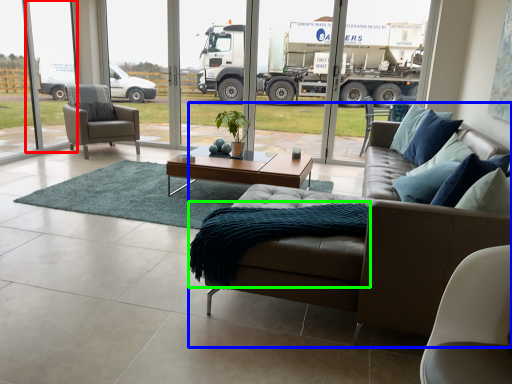
Question: Based on their relative distances, which object is nearer to window screen (highlighted by a red box)? Choose from studio couch (highlighted by a blue box) and blanket (highlighted by a green box).

Choices:
 (A) studio couch
 (B) blanket

Answer: (B)